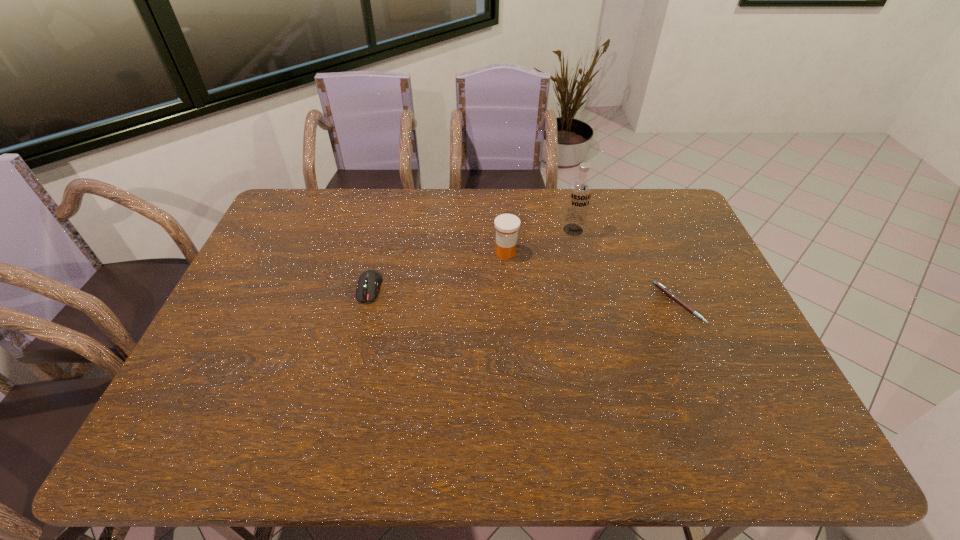
At what (x,y) coordinates should I click in order to perform the action: click on blank region between the second tallest object and the second shortest object. Please return your answer as a coordinate pair (x, y). Looking at the image, I should click on (438, 270).

In order to click on free space between the shortest object and the vodka in this screenshot , I will do `click(626, 267)`.

Identify the location of vacant area between the vodka and the shortest object. Image resolution: width=960 pixels, height=540 pixels. (626, 267).

Locate an element on the screen. Image resolution: width=960 pixels, height=540 pixels. the closest object to the rightmost object is located at coordinates (580, 189).

This screenshot has height=540, width=960. Find the location of `object that stands as the second closest to the third nearest object`. object that stands as the second closest to the third nearest object is located at coordinates (369, 281).

At what (x,y) coordinates should I click in order to perform the action: click on free spot that satisfies the following two spatial constraints: 1. on the button of the second shortest object; 2. at the nib of the rightmost object. Please return your answer as a coordinate pair (x, y). This screenshot has height=540, width=960. Looking at the image, I should click on (366, 303).

Where is `vacant space that satisfies the following two spatial constraints: 1. on the button of the leftmost object; 2. at the nib of the pen`? This screenshot has height=540, width=960. vacant space that satisfies the following two spatial constraints: 1. on the button of the leftmost object; 2. at the nib of the pen is located at coordinates (366, 303).

Identify the location of free spot that satisfies the following two spatial constraints: 1. on the button of the computer equipment; 2. at the nib of the shortest object. (366, 303).

The width and height of the screenshot is (960, 540). I want to click on blank space that satisfies the following two spatial constraints: 1. on the front side of the pen; 2. at the nib of the third nearest object, so click(509, 303).

Where is `blank space that satisfies the following two spatial constraints: 1. on the button of the shortest object; 2. at the nib of the third tallest object`? blank space that satisfies the following two spatial constraints: 1. on the button of the shortest object; 2. at the nib of the third tallest object is located at coordinates (366, 303).